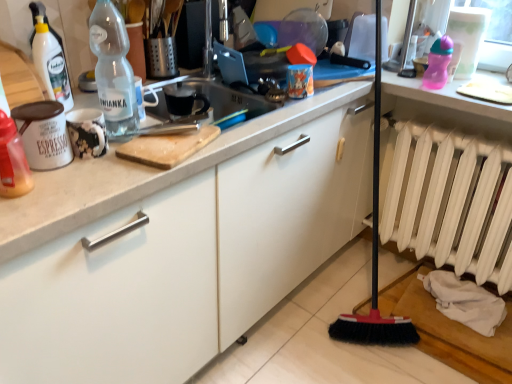
Question: Does point (122, 102) appear closer or farther from the camera than point (397, 180)?

Choices:
 (A) closer
 (B) farther

Answer: (A)

Question: In the image, is transparent plastic bottle at upper left, positioned as the 2th bottle in bottom-to-top order, positioned in front of or behind white matte radiator at lower right?

Choices:
 (A) front
 (B) behind

Answer: (A)

Question: Which object is the farthest from the white matte radiator at lower right?

Choices:
 (A) translucent plastic bottle at left, which appears as the 2th bottle when viewed from the back
 (B) transparent plastic bottle at upper left, arranged as the second bottle when viewed from the left

Answer: (A)

Question: Which object is the farthest from the white matte radiator at lower right?

Choices:
 (A) transparent plastic bottle at upper left, the 2th bottle positioned from the front
 (B) translucent plastic bottle at left, acting as the second bottle starting from the top

Answer: (B)